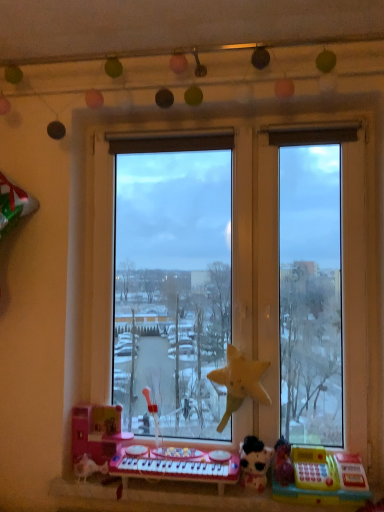
Identify the location of vacant space in pink plastic musical keyboard at lower center (from a real-world perspective). (183, 488).